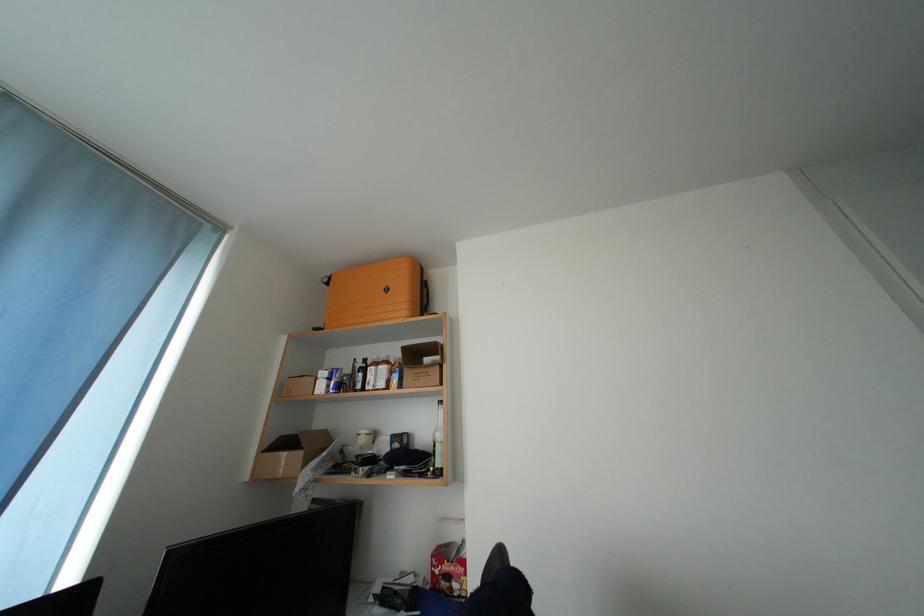
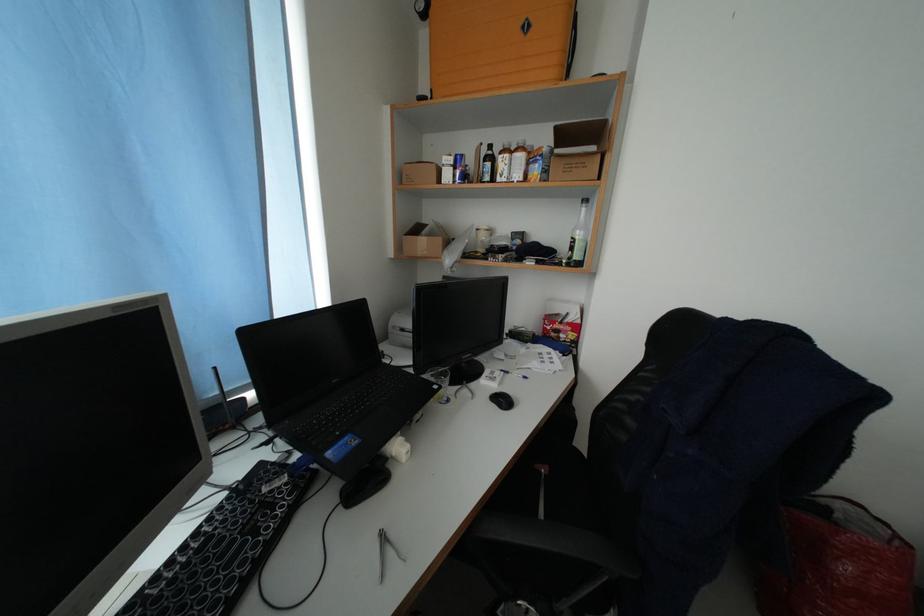
The point at (x=445, y=469) is marked in the first image. Where is the corresponding point in the second image?

(582, 262)